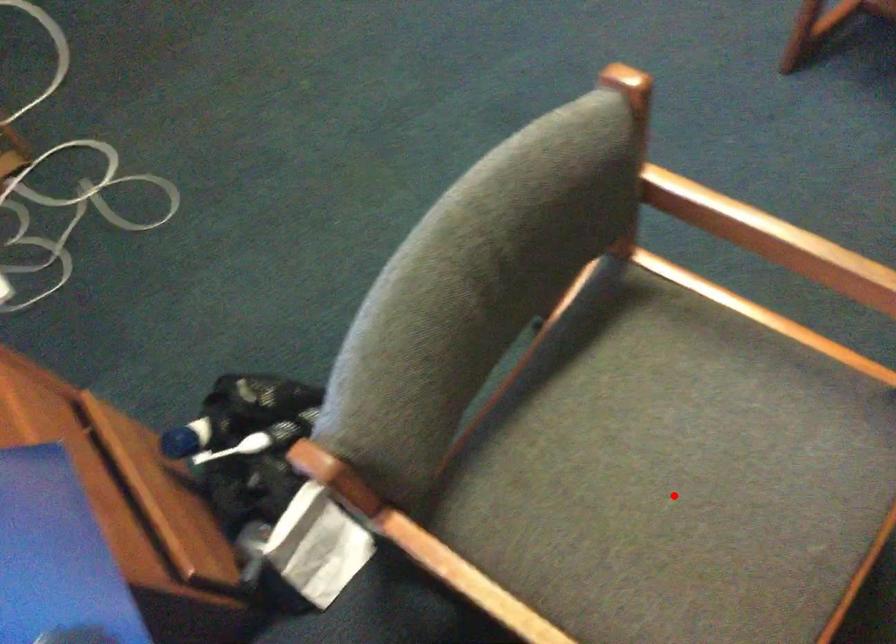
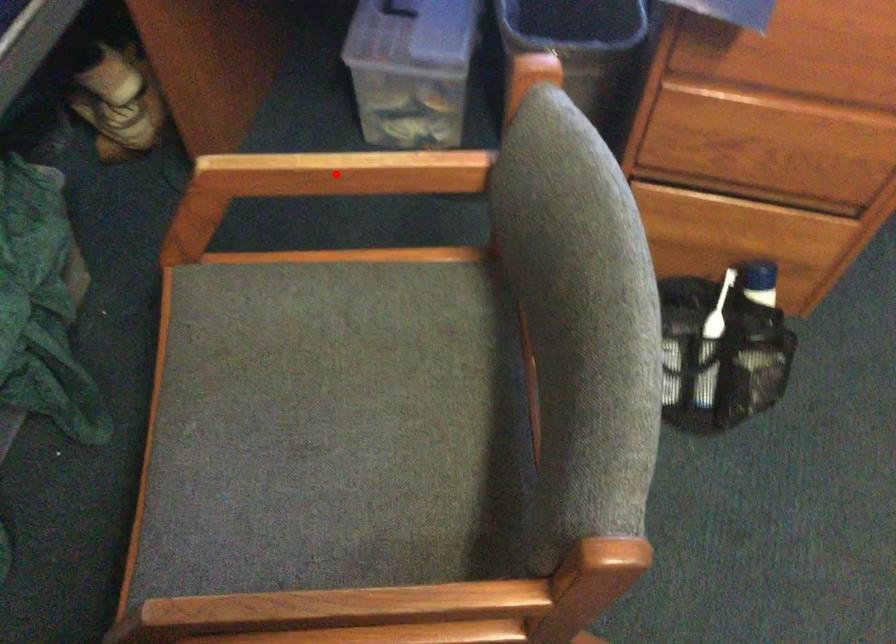
I am providing you with two images of the same scene from different viewpoints. A red point is marked on the first image and another point is marked on the second image. Is the marked point in image1 the same physical position as the marked point in image2?

No